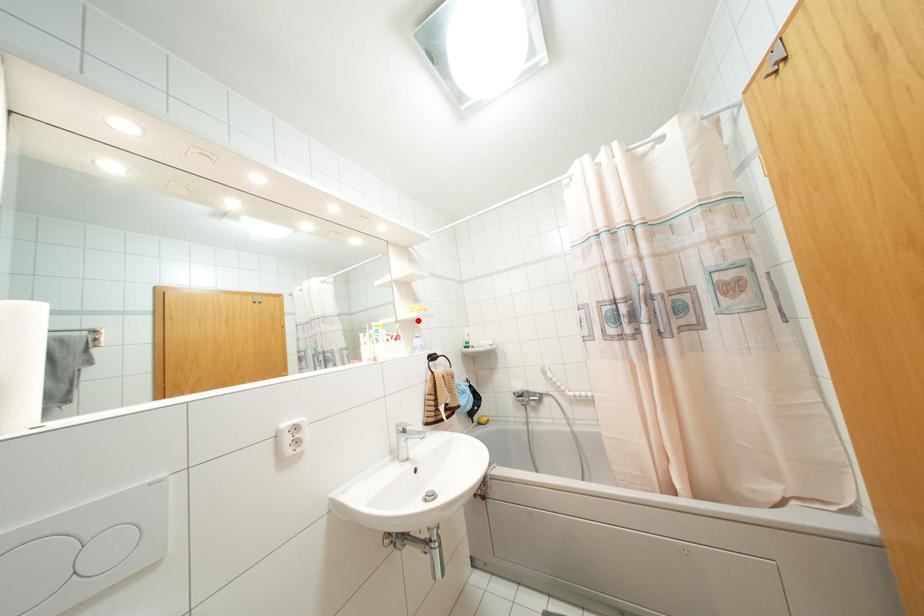
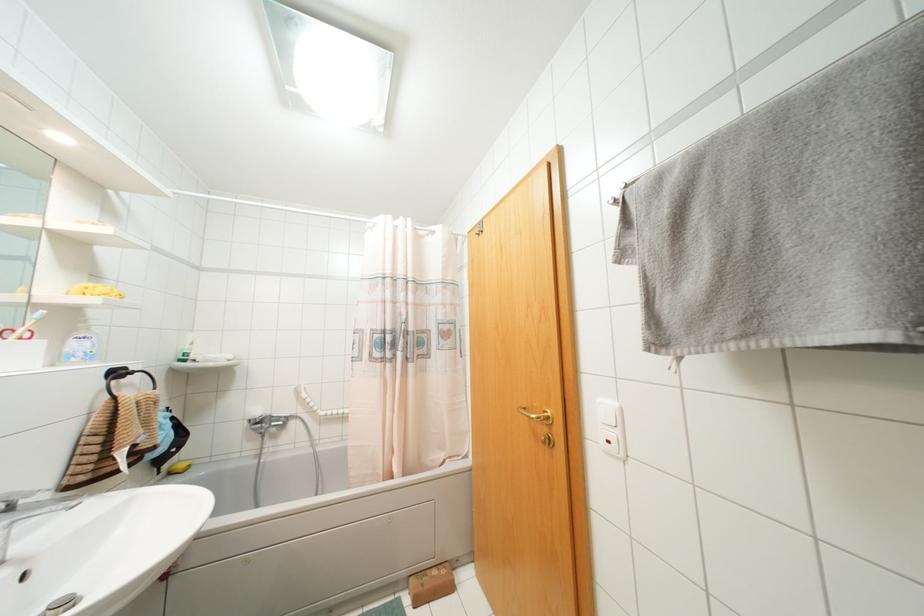
In the second image, find the point that corresponds to the highlighted location in the first image.

(89, 310)